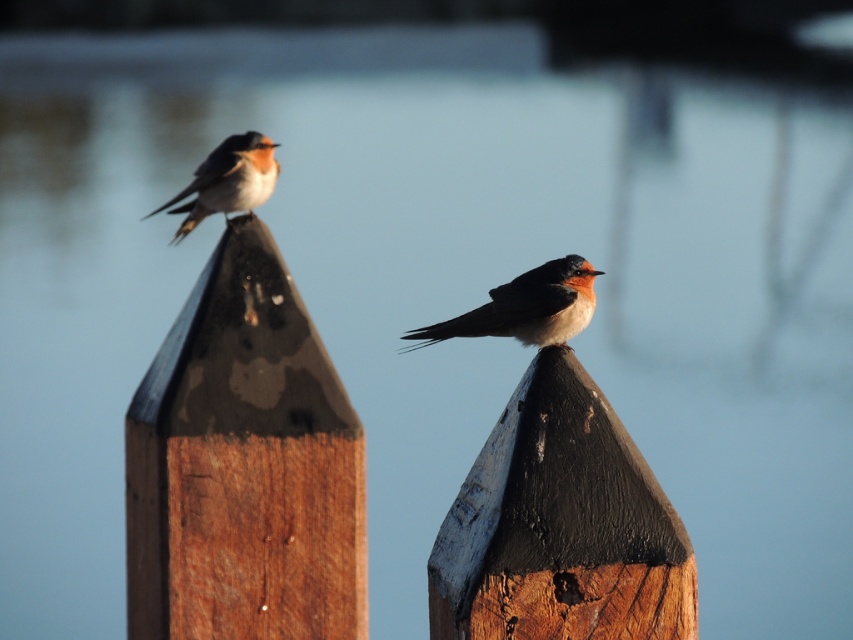
Question: Which point is closer to the camera taking this photo?

Choices:
 (A) pyautogui.click(x=148, y=212)
 (B) pyautogui.click(x=173, y=333)
 (C) pyautogui.click(x=659, y=545)

Answer: (C)

Question: Among these objects, which one is nearest to the camera?

Choices:
 (A) brown wood post at upper center
 (B) orange-brown feathers at center
 (C) bright orange plumage at upper left
 (D) painted wood post at center

Answer: (D)

Question: Is painted wood post at center behind orange-brown feathers at center?

Choices:
 (A) yes
 (B) no

Answer: (B)

Question: Does brown wood post at upper center appear on the right side of bright orange plumage at upper left?

Choices:
 (A) yes
 (B) no

Answer: (A)

Question: Which point is farther to the camera?

Choices:
 (A) painted wood post at center
 (B) orange-brown feathers at center
 (C) brown wood post at upper center
 (D) bright orange plumage at upper left

Answer: (D)

Question: Is painted wood post at center behind orange-brown feathers at center?

Choices:
 (A) yes
 (B) no

Answer: (B)